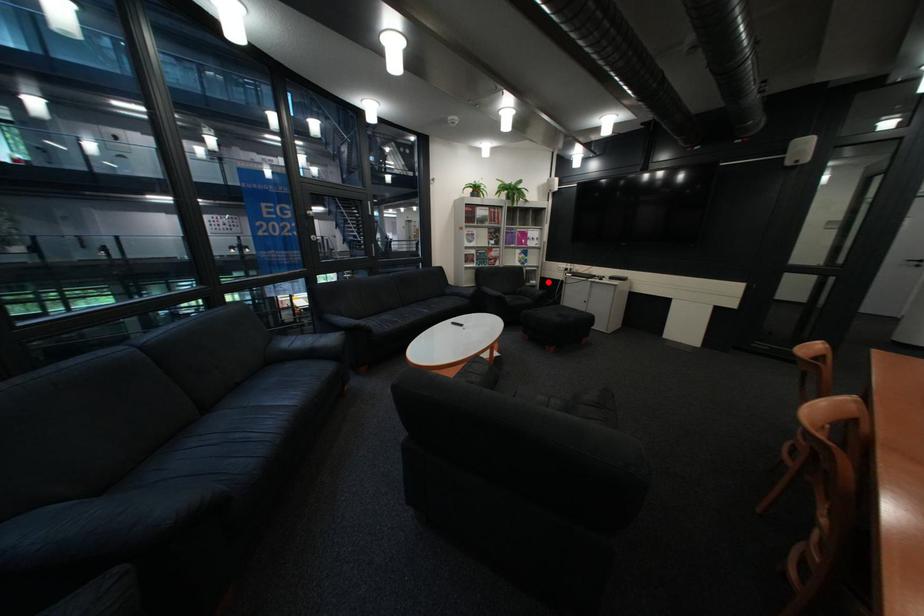
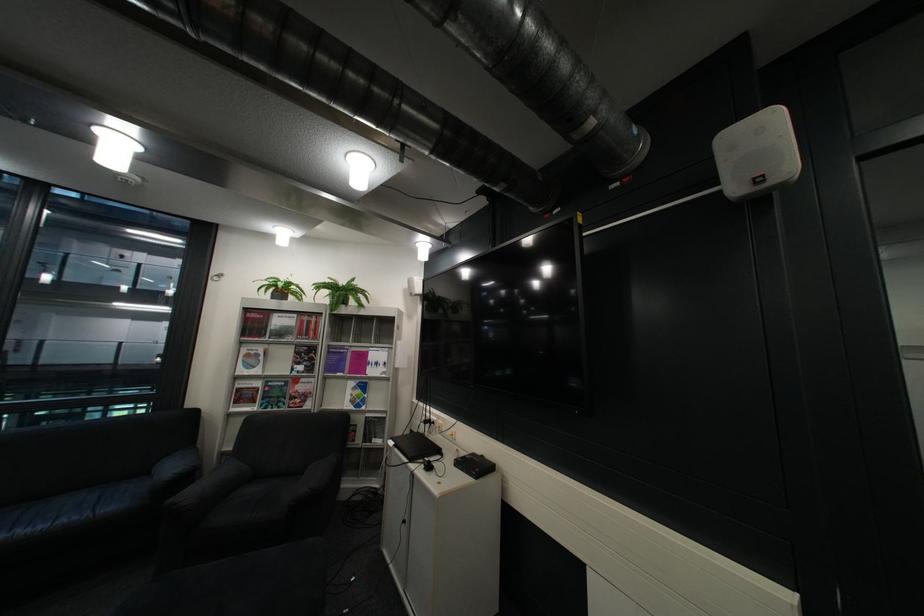
Question: I am providing you with two images of the same scene from different viewpoints. In image1, a red point is highlighted. Considering the same 3D point in image2, which of the following is correct?

Choices:
 (A) It is closer
 (B) It is farther

Answer: (B)